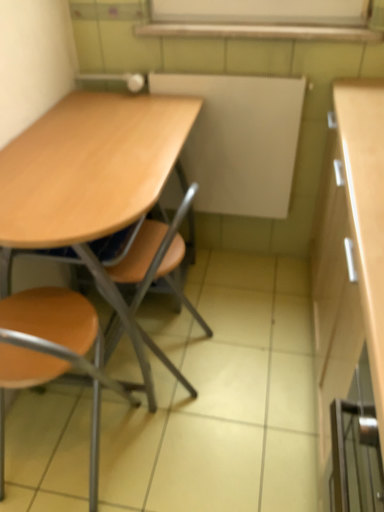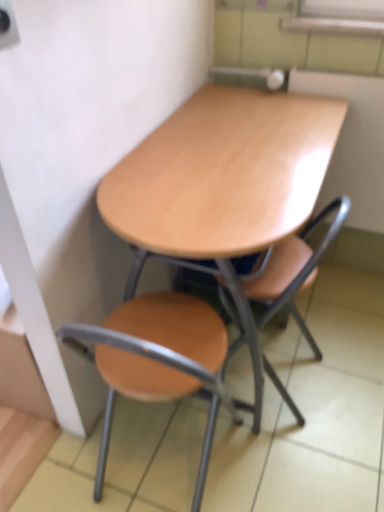
Question: How did the camera likely rotate when shooting the video?

Choices:
 (A) rotated left
 (B) rotated right

Answer: (A)